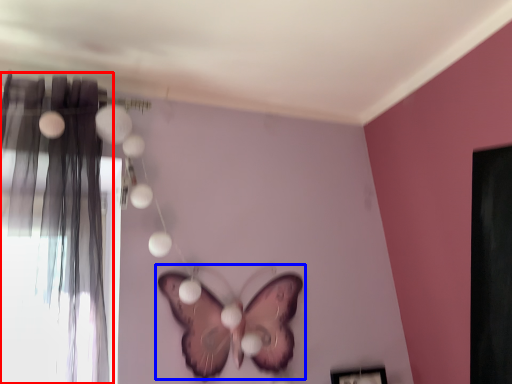
Question: Which object is closer to the camera taking this photo, curtain (highlighted by a red box) or butterfly (highlighted by a blue box)?

Choices:
 (A) curtain
 (B) butterfly

Answer: (A)